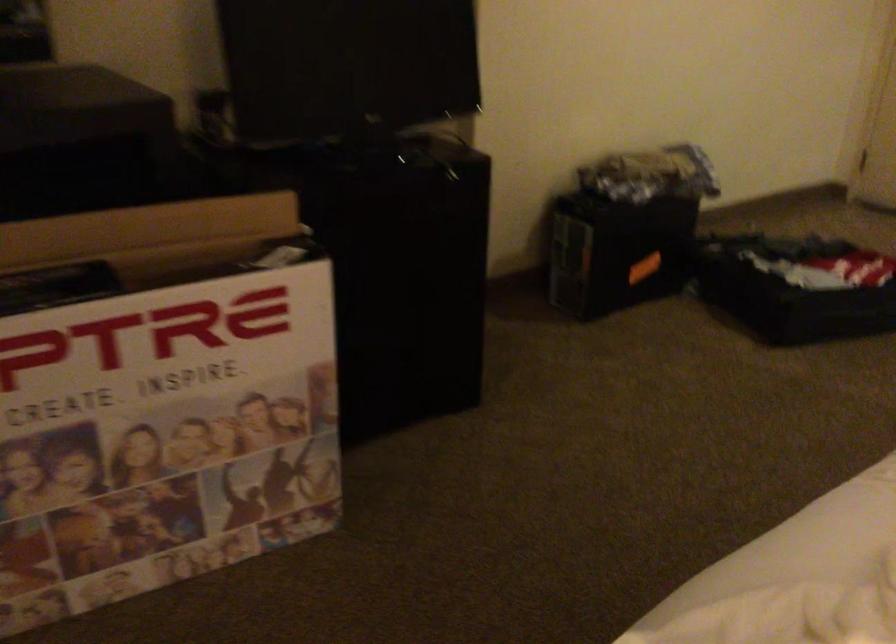
This screenshot has width=896, height=644. What are the coordinates of `open black suitcase` in the screenshot? It's located at (794, 287).